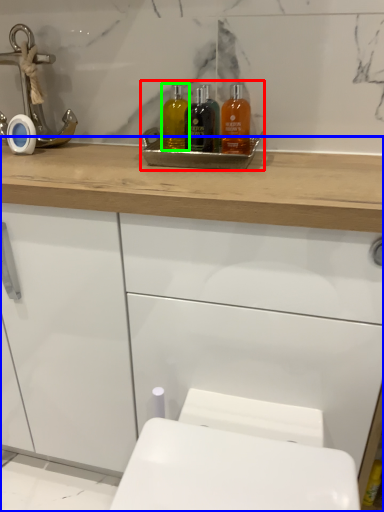
Question: Which object is positioned closest to sink (highlighted by a red box)? Select from bathroom cabinet (highlighted by a blue box) and mouthwash (highlighted by a green box).

Choices:
 (A) bathroom cabinet
 (B) mouthwash

Answer: (B)